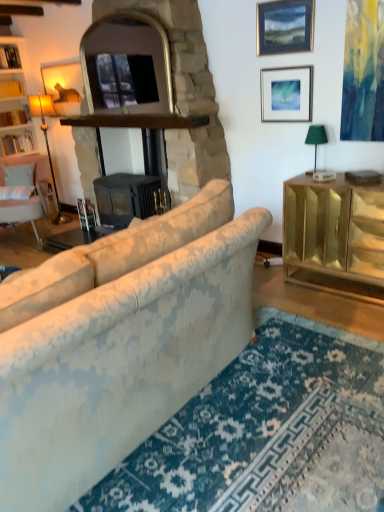
Question: Which direction should I rotate to look at matte black picture frame at upper center, which is counted as the first picture frame, starting from the top?

Choices:
 (A) left
 (B) right

Answer: (B)

Question: Would you say matte gold floor lamp at left, arranged as the 2th lamp when viewed from the front, is part of gold mirrored cabinet at right's contents?

Choices:
 (A) yes
 (B) no

Answer: (B)

Question: Is gold mirrored cabinet at right shorter than matte gold floor lamp at left, the first lamp from the left?

Choices:
 (A) no
 (B) yes

Answer: (B)

Question: Could you tell me if gold mirrored cabinet at right is turned towards matte gold floor lamp at left, arranged as the 2th lamp when viewed from the front?

Choices:
 (A) yes
 (B) no

Answer: (B)

Question: Is gold mirrored cabinet at right facing away from matte gold floor lamp at left, arranged as the 2th lamp when viewed from the front?

Choices:
 (A) no
 (B) yes

Answer: (A)

Question: Is gold mirrored cabinet at right next to matte gold floor lamp at left, arranged as the 2th lamp when viewed from the front, and touching it?

Choices:
 (A) yes
 (B) no

Answer: (B)

Question: Is gold mirrored cabinet at right outside matte gold floor lamp at left, the first lamp from the left?

Choices:
 (A) no
 (B) yes

Answer: (B)

Question: Can you confirm if light pink fabric chair at left is taller than black matte fireplace at center, the second fireplace from the left?

Choices:
 (A) no
 (B) yes

Answer: (A)

Question: Is light pink fabric chair at left to the right of black matte fireplace at center, the second fireplace from the left, from the viewer's perspective?

Choices:
 (A) no
 (B) yes

Answer: (A)

Question: Is light pink fabric chair at left completely or partially outside of black matte fireplace at center, which appears as the first fireplace when viewed from the right?

Choices:
 (A) yes
 (B) no

Answer: (A)

Question: Is light pink fabric chair at left smaller than black matte fireplace at center, which appears as the first fireplace when viewed from the right?

Choices:
 (A) yes
 (B) no

Answer: (A)

Question: Can you confirm if light pink fabric chair at left is bigger than black matte fireplace at center, the second fireplace from the left?

Choices:
 (A) no
 (B) yes

Answer: (A)

Question: From the image's perspective, would you say light pink fabric chair at left is positioned over black matte fireplace at center, which appears as the first fireplace when viewed from the right?

Choices:
 (A) yes
 (B) no

Answer: (B)

Question: Is gold mirrored cabinet at right further to the viewer compared to white wood bookshelf at left?

Choices:
 (A) no
 (B) yes

Answer: (A)